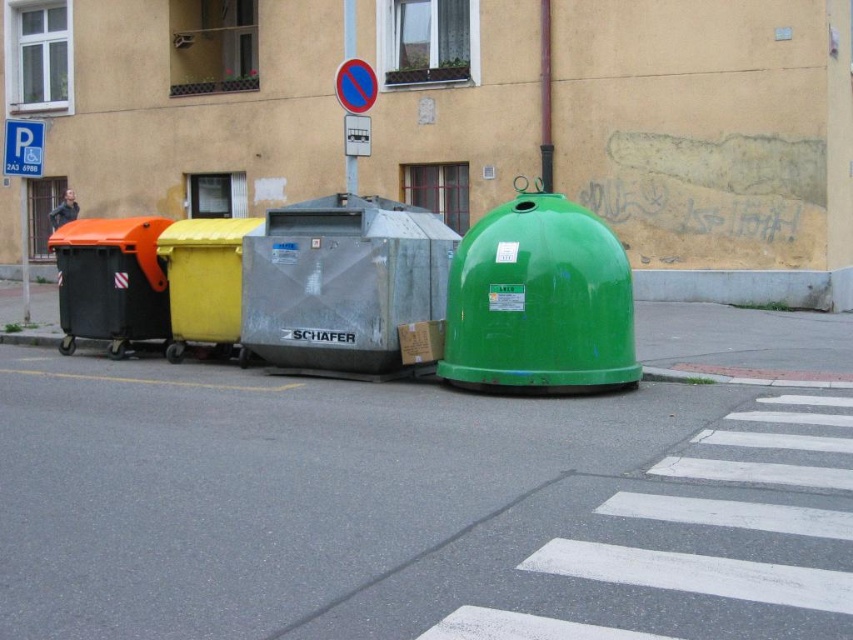
Question: Estimate the real-world distances between objects in this image. Which object is closer to the green matte recycling bin at center?

Choices:
 (A) orange plastic recycling bin at left
 (B) yellow plastic recycling bin at left

Answer: (B)

Question: Which of the following is the farthest from the observer?

Choices:
 (A) green matte recycling bin at center
 (B) orange plastic recycling bin at left
 (C) yellow plastic recycling bin at left

Answer: (B)

Question: Does metallic gray recycling bin at center have a lesser width compared to orange plastic recycling bin at left?

Choices:
 (A) yes
 (B) no

Answer: (B)

Question: Does orange plastic recycling bin at left appear on the left side of yellow plastic recycling bin at left?

Choices:
 (A) no
 (B) yes

Answer: (B)

Question: Is orange plastic recycling bin at left further to camera compared to yellow plastic recycling bin at left?

Choices:
 (A) no
 (B) yes

Answer: (B)

Question: Estimate the real-world distances between objects in this image. Which object is farther from the yellow plastic recycling bin at left?

Choices:
 (A) green matte recycling bin at center
 (B) metallic gray recycling bin at center
 (C) orange plastic recycling bin at left

Answer: (A)